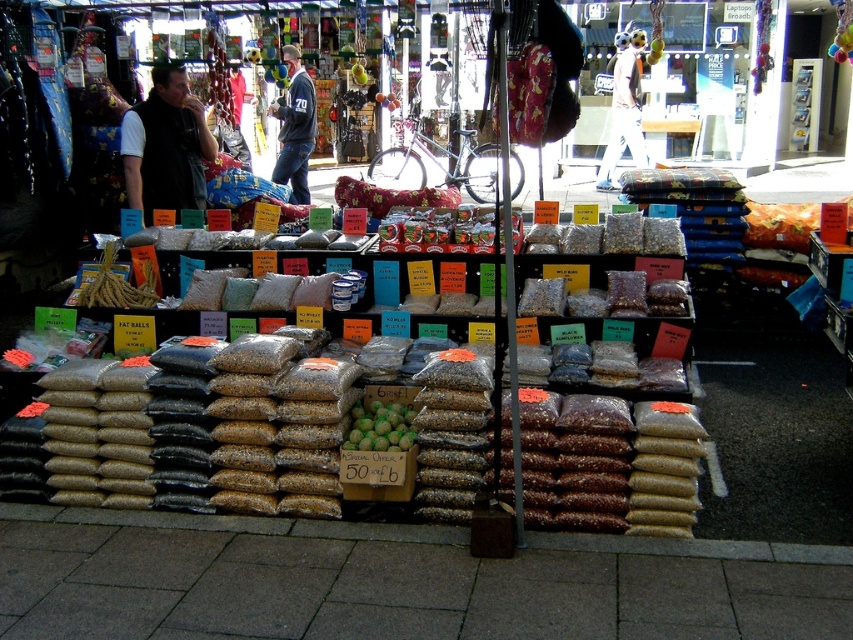
Question: Can you confirm if black vest at left is thinner than green matte fruit at center?

Choices:
 (A) no
 (B) yes

Answer: (A)

Question: Which point is farther from the camera taking this photo?

Choices:
 (A) (144, 177)
 (B) (625, 108)

Answer: (B)

Question: Does dark blue jersey at center come in front of green matte fruit at center?

Choices:
 (A) yes
 (B) no

Answer: (B)

Question: Which of these objects is positioned farthest from the black vest at left?

Choices:
 (A) white plush teddy bear at upper center
 (B) dark blue jersey at center

Answer: (A)

Question: Is black vest at left further to camera compared to dark blue jersey at center?

Choices:
 (A) no
 (B) yes

Answer: (A)

Question: Which of the following is the closest to the observer?

Choices:
 (A) (619, 84)
 (B) (351, 442)
 (C) (183, 193)

Answer: (B)